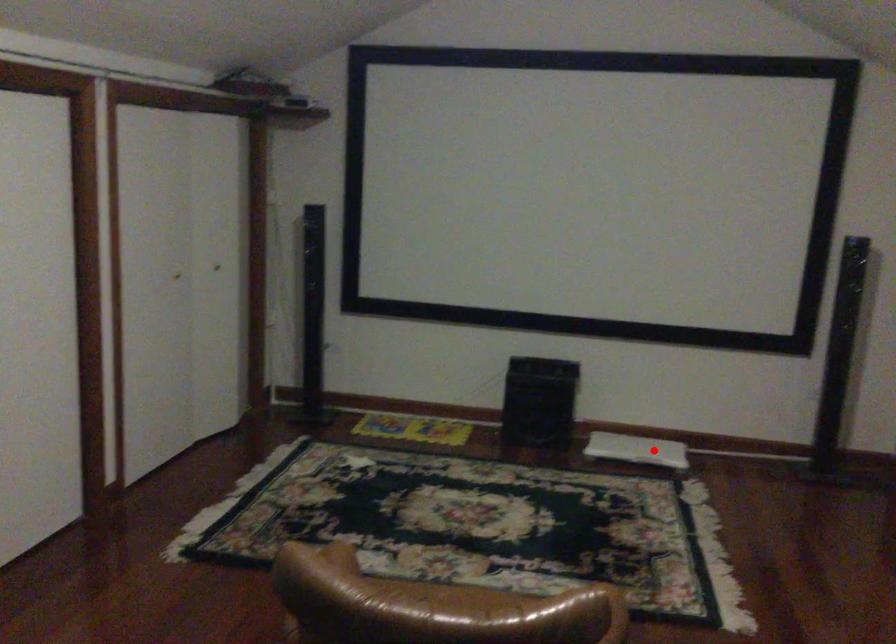
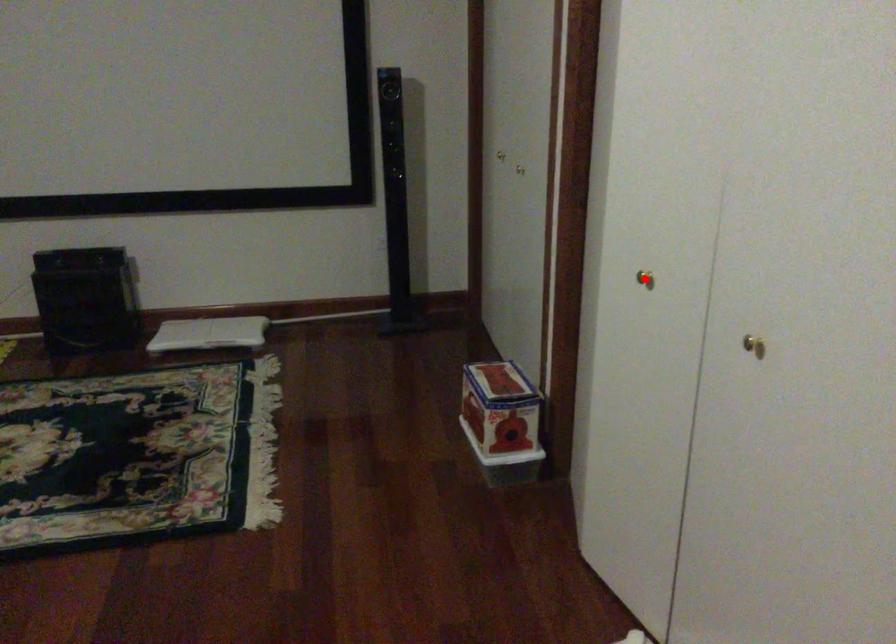
I am providing you with two images of the same scene from different viewpoints. A red point is marked on the first image and another point is marked on the second image. Is the red point in image1 aligned with the point shown in image2?

No